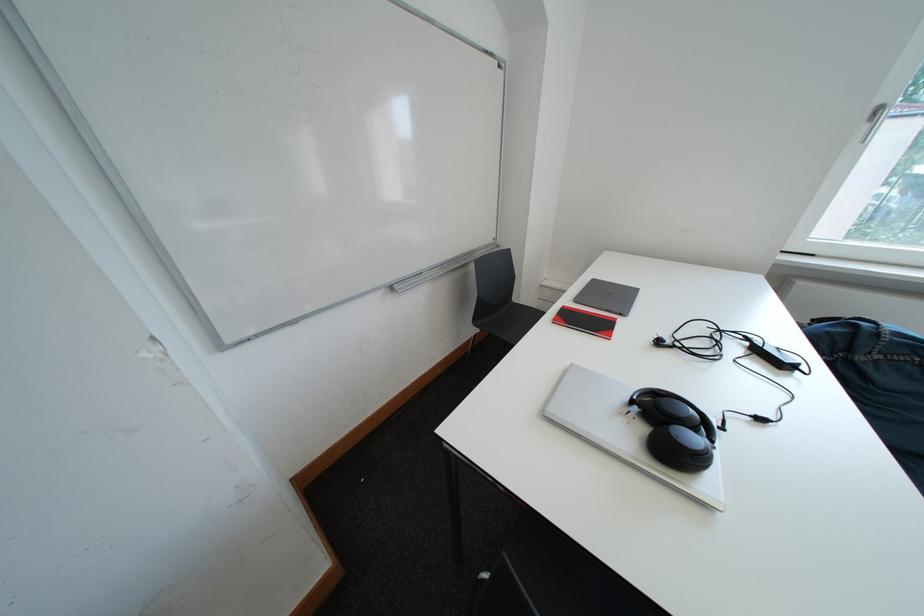
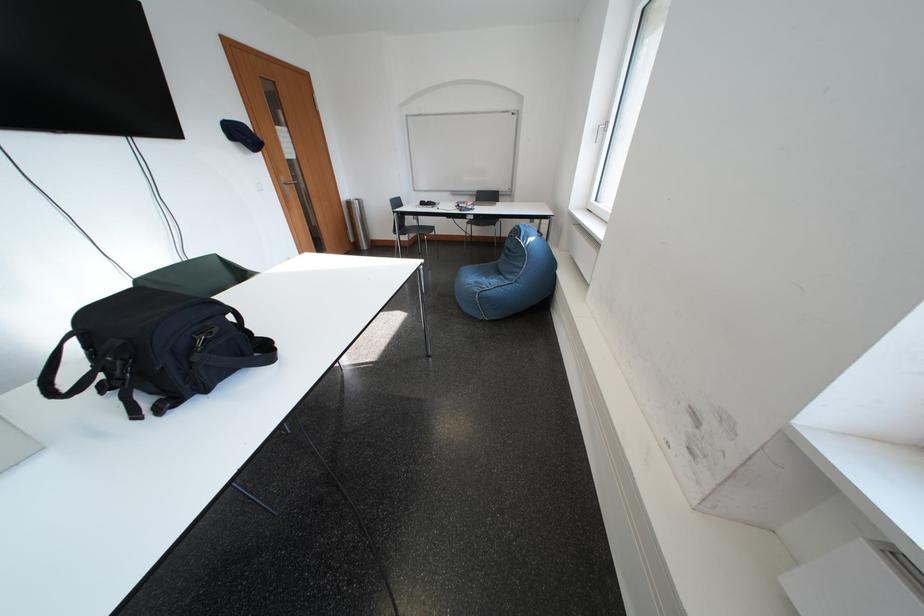
Question: I am providing you with two images of the same scene from different viewpoints. Please identify which objects are invisible in image2.

Choices:
 (A) pink  case
 (B) black power brick
 (C) sofa sitting surface
 (D) chair sitting surface

Answer: (B)